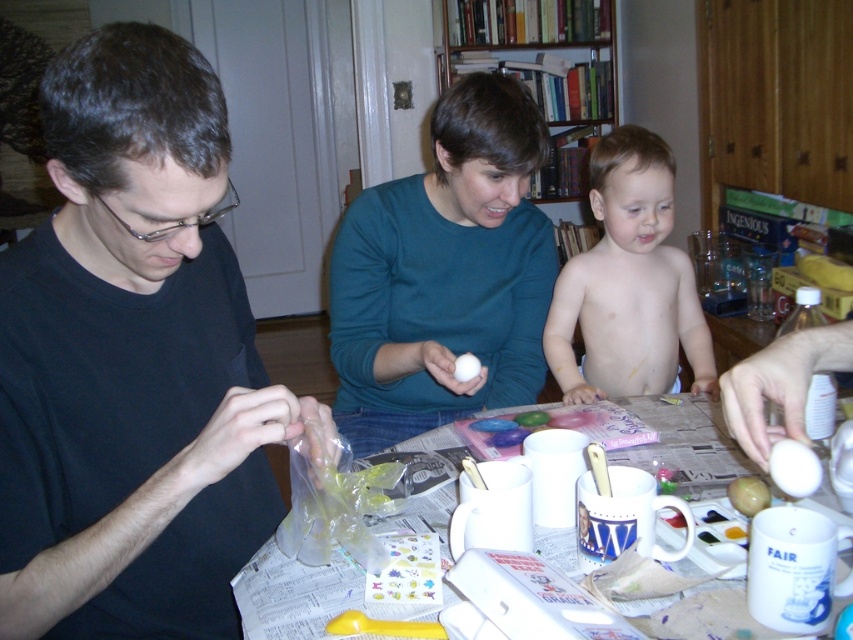
Based on the photo, you are a guest at this family gathering and want to compliment the person wearing the black matte shirt at left. Which direction should you look relative to the white glossy egg at center?

The black matte shirt at left is located to the left of the white glossy egg at center, so you should look to the left side of the egg to find the person wearing it.

You are a photographer trying to capture a closeup of the white glossy egg at center. You notice the black matte shirt at left might block the view. Based on their sizes, do you think you can position yourself to avoid the shirt blocking the egg?

The black matte shirt at left is much taller than the white glossy egg at center, so positioning yourself lower or moving the shirt slightly might help avoid the blockage.